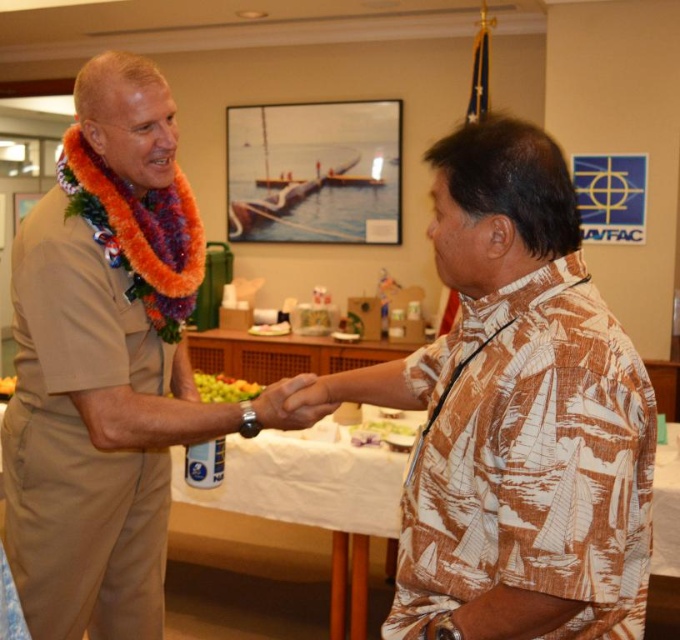
You are an observer in the scene. You notice the tan uniform at center and the smooth skin hand at center. Which object occupies more space in the image?

The tan uniform at center is larger in size than the smooth skin hand at center, so it occupies more space in the image.

Based on the photo, you are a photographer positioned to capture this interaction. The brown printed shirt at right and the smooth skin hand at center are in your frame. Based on their sizes in the photo, which object appears larger?

The brown printed shirt at right appears larger because it is much taller than the smooth skin hand at center.

You are a photographer standing 10 feet away from the tan uniform at center and the smooth skin hand at center. You want to capture a closeup shot of both objects in the same frame. Given that your camera has a 50mm lens, which has a maximum focusing distance of 10 feet, can you focus on both objects simultaneously?

The tan uniform at center and smooth skin hand at center are 15.16 inches apart from each other. Since the camera can focus up to 10 feet, and the distance between them is within that range, you can focus on both objects simultaneously.